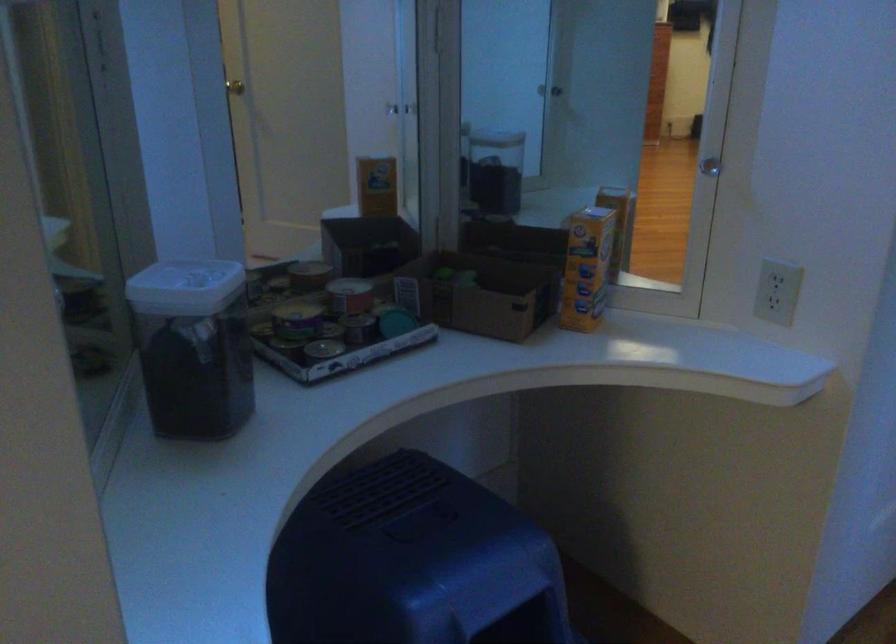
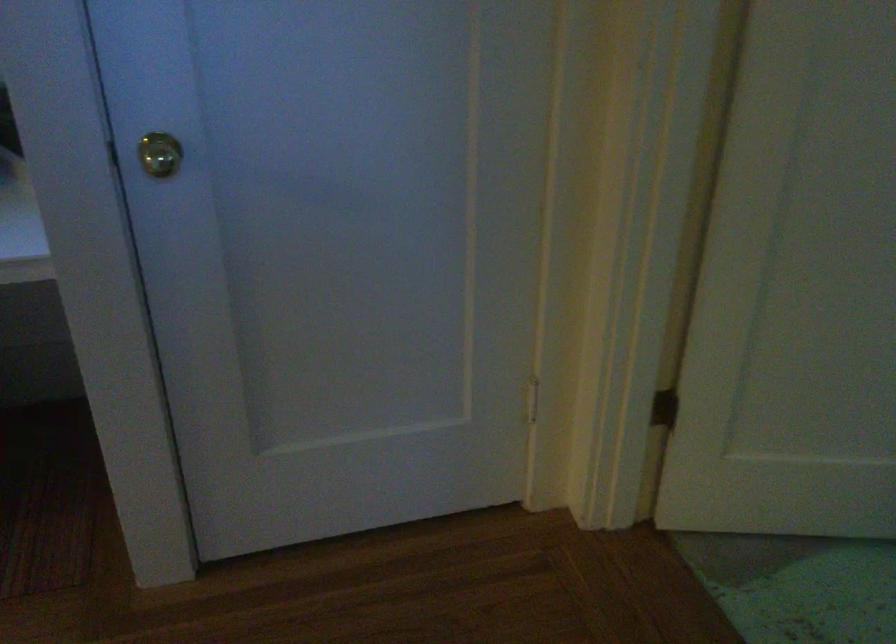
Question: Which direction would the cameraman need to move to produce the second image? Reply with the corresponding letter.

Choices:
 (A) Left
 (B) Right
 (C) Forward
 (D) Backward

Answer: (B)